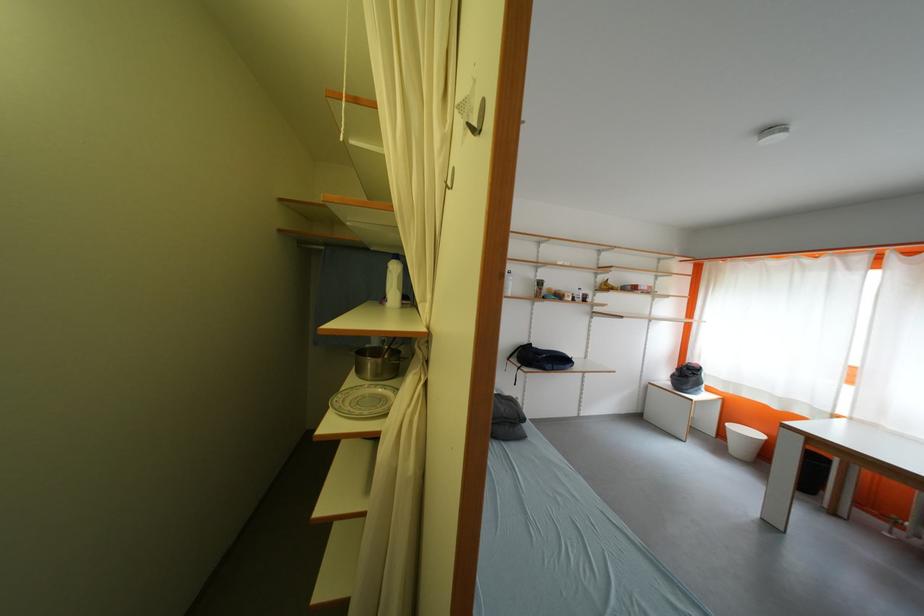
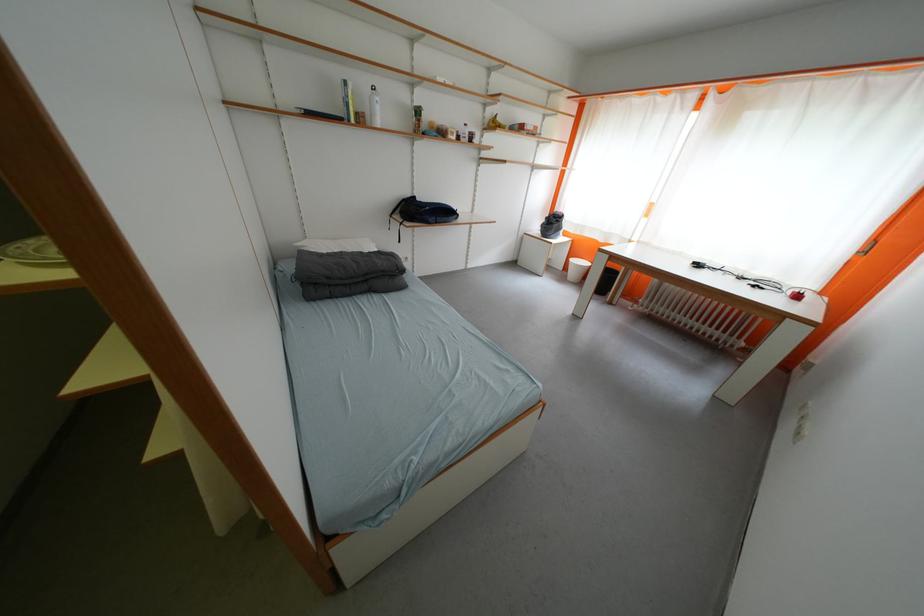
Based on the continuous images, in which direction is the camera rotating?

The camera rotated toward right-down.